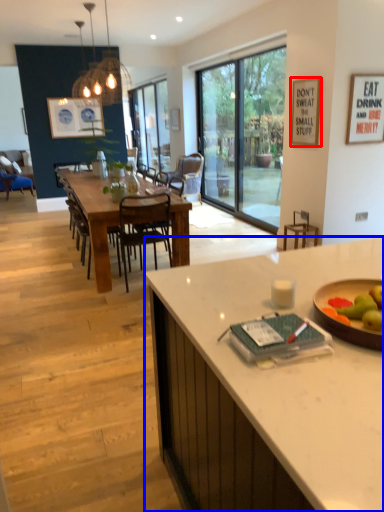
Question: Which point is closer to the camera, picture frame (highlighted by a red box) or desk (highlighted by a blue box)?

Choices:
 (A) picture frame
 (B) desk

Answer: (B)